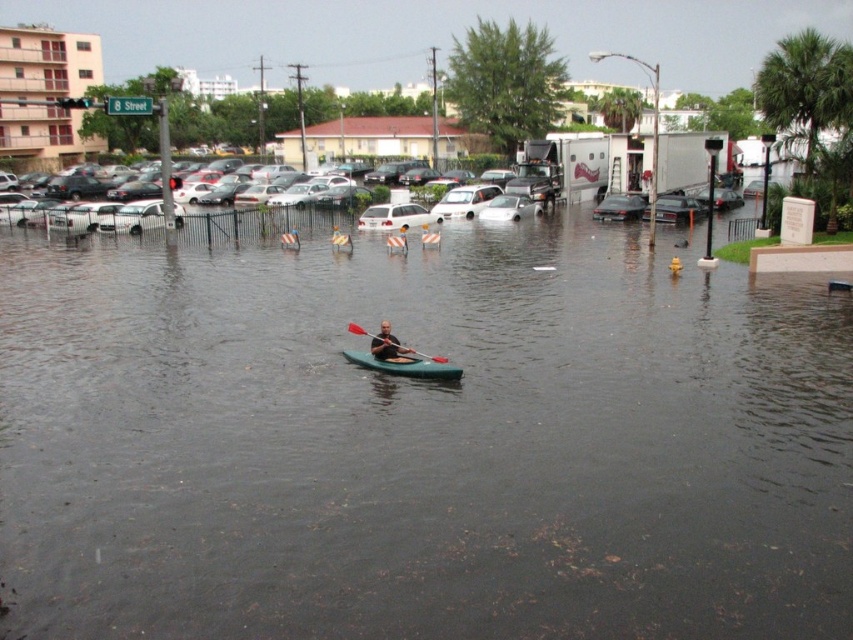
Based on the photo, can you confirm if green matte kayak at center is taller than white matte van at center?

No.

Looking at this image, can you confirm if green matte kayak at center is positioned to the left of white matte van at center?

Incorrect, green matte kayak at center is not on the left side of white matte van at center.

Find the location of a particular element. The image size is (853, 640). green matte kayak at center is located at coordinates (405, 365).

Can you confirm if white matte van at center is shorter than green matte paddle at center?

In fact, white matte van at center may be taller than green matte paddle at center.

Does white matte van at center appear over green matte paddle at center?

Indeed, white matte van at center is positioned over green matte paddle at center.

This screenshot has width=853, height=640. In order to click on white matte van at center in this screenshot , I will do `click(395, 216)`.

The image size is (853, 640). I want to click on white matte van at center, so click(395, 216).

Can you confirm if dark gray water at center is taller than white matte van at center?

Yes.

Image resolution: width=853 pixels, height=640 pixels. I want to click on dark gray water at center, so click(421, 444).

Is point (811, 378) positioned after point (378, 214)?

No, it is in front of (378, 214).

The height and width of the screenshot is (640, 853). Identify the location of dark gray water at center. (421, 444).